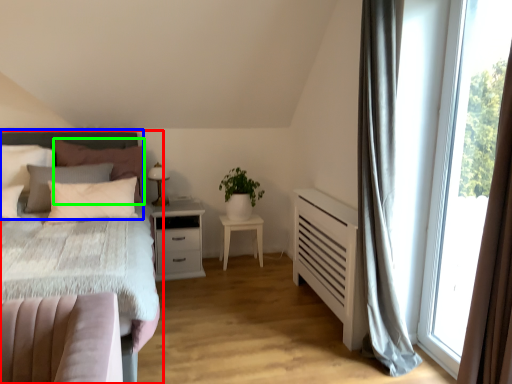
Question: Based on their relative distances, which object is farther from bed (highlighted by a red box)? Choose from headboard (highlighted by a blue box) and pillow (highlighted by a green box).

Choices:
 (A) headboard
 (B) pillow

Answer: (B)